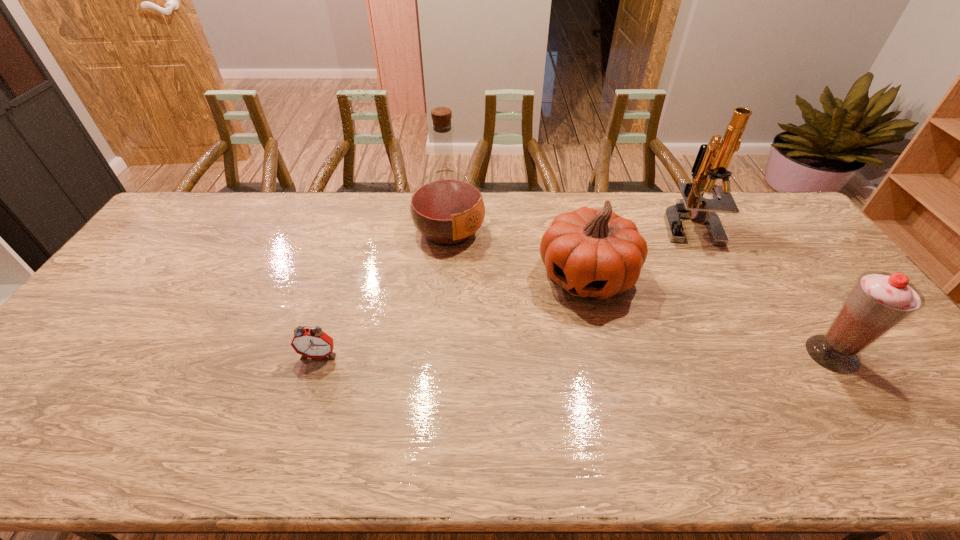
Where is `vacant point located between the leftmost object and the pumpkin`? The image size is (960, 540). vacant point located between the leftmost object and the pumpkin is located at coordinates coord(453,315).

You are a GUI agent. You are given a task and a screenshot of the screen. Output one action in this format:
    pyautogui.click(x=<x>, y=<y>)
    Task: Click on the free space between the third tallest object and the fourth object from right to left
    The height and width of the screenshot is (540, 960).
    Given the screenshot: What is the action you would take?
    pyautogui.click(x=640, y=292)

Where is `free spot between the alarm clock and the second object from left to right`? The image size is (960, 540). free spot between the alarm clock and the second object from left to right is located at coordinates (384, 293).

Identify which object is located as the fourth nearest to the alarm clock. Please provide its 2D coordinates. Your answer should be formatted as a tuple, i.e. [(x, y)], where the tuple contains the x and y coordinates of a point satisfying the conditions above.

[(879, 302)]

Select which object appears as the third closest to the alarm clock. Please provide its 2D coordinates. Your answer should be formatted as a tuple, i.e. [(x, y)], where the tuple contains the x and y coordinates of a point satisfying the conditions above.

[(712, 161)]

Where is `free point that satisfies the following two spatial constraints: 1. on the front side of the liquor; 2. on the left side of the third object from left to right`? free point that satisfies the following two spatial constraints: 1. on the front side of the liquor; 2. on the left side of the third object from left to right is located at coordinates (445, 276).

You are a GUI agent. You are given a task and a screenshot of the screen. Output one action in this format:
    pyautogui.click(x=<x>, y=<y>)
    Task: Click on the free space that satisfies the following two spatial constraints: 1. on the front side of the third tallest object; 2. on the left side of the pumpkin
    This screenshot has height=540, width=960.
    Given the screenshot: What is the action you would take?
    pyautogui.click(x=606, y=354)